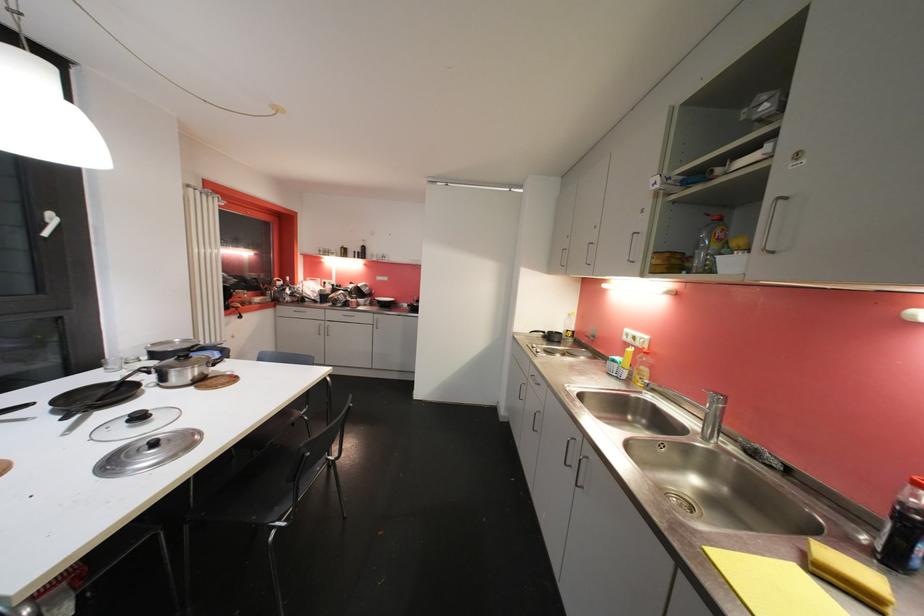
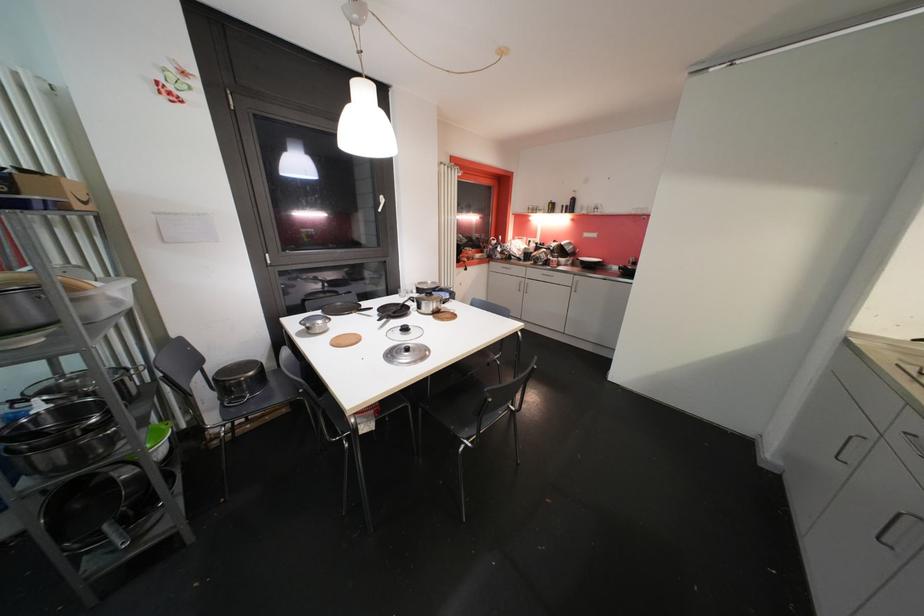
The point at (x=144, y=419) is marked in the first image. Where is the corresponding point in the second image?

(409, 331)